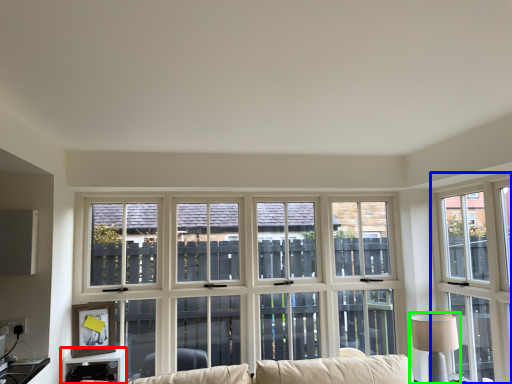
Question: Considering the real-world distances, which object is closest to table (highlighted by a red box)? window (highlighted by a blue box) or table lamp (highlighted by a green box).

Choices:
 (A) window
 (B) table lamp

Answer: (B)